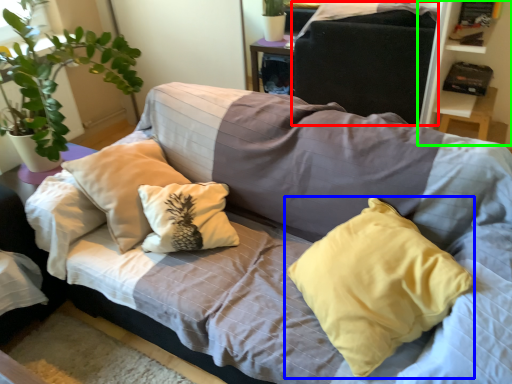
Question: Which object is positioned farthest from gray (highlighted by a red box)? Select from pillow (highlighted by a blue box) and bookshelf (highlighted by a green box).

Choices:
 (A) pillow
 (B) bookshelf

Answer: (A)